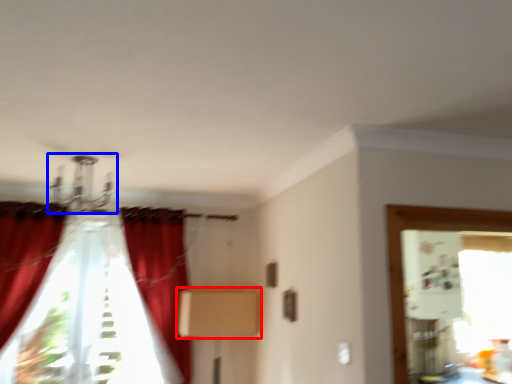
Question: Which point is further to the camera, cardboard box (highlighted by a red box) or light fixture (highlighted by a blue box)?

Choices:
 (A) cardboard box
 (B) light fixture

Answer: (A)